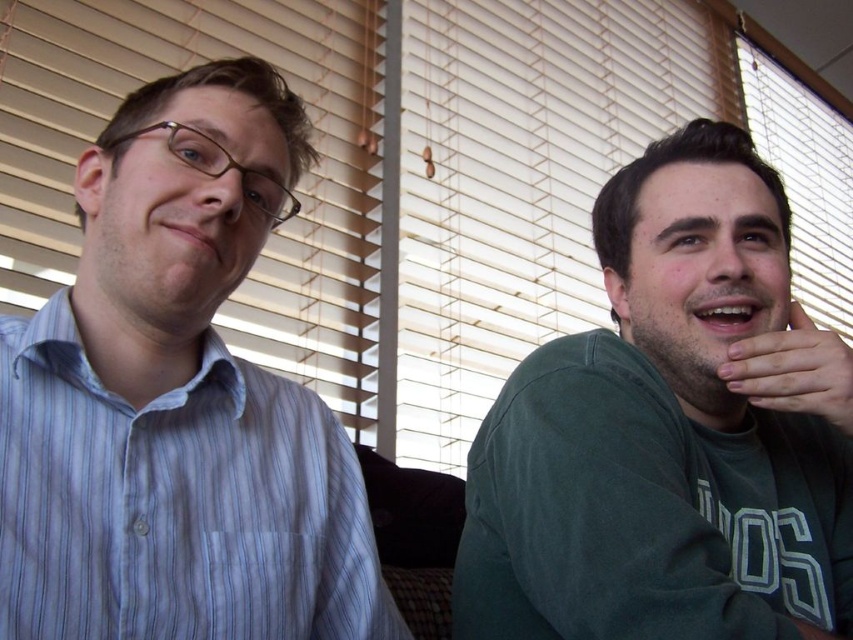
Question: Among these points, which one is farthest from the camera?

Choices:
 (A) (804, 403)
 (B) (726, 246)

Answer: (B)

Question: Is blue striped shirt at left above matte wood blinds at center?

Choices:
 (A) yes
 (B) no

Answer: (B)

Question: Estimate the real-world distances between objects in this image. Which object is closer to the matte wood blinds at center?

Choices:
 (A) matte striped shirt at left
 (B) green matte shirt at right
 (C) blue striped shirt at left
 (D) matte skin hand at right

Answer: (A)

Question: Which point is closer to the camera?

Choices:
 (A) (317, 74)
 (B) (271, 522)
 (C) (838, 378)

Answer: (B)

Question: Is green matte shirt at right bigger than blue striped shirt at left?

Choices:
 (A) yes
 (B) no

Answer: (A)

Question: Does matte wood blinds at center come behind matte striped shirt at left?

Choices:
 (A) yes
 (B) no

Answer: (A)